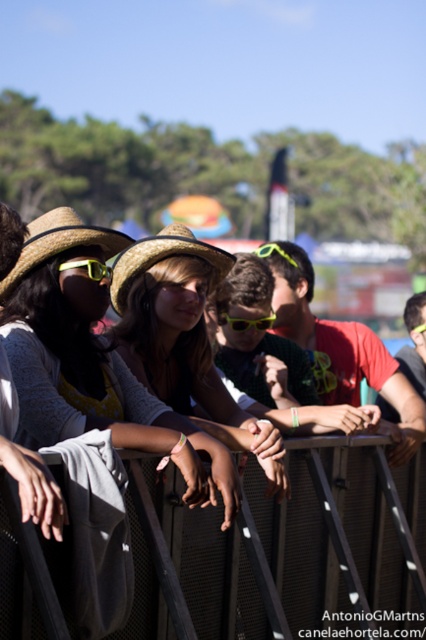
You are standing at the festival and want to reach the point marked at coordinates (261, 524). If your walking speed is 1.2 meters per second, how many seconds will it take you to reach that point?

The point at coordinates (261, 524) is 10.38 meters away from the viewer. At a walking speed of 1.2 meters per second, it would take approximately 8.65 seconds to reach the point.

Based on the photo, you are a photographer trying to capture a clear shot of the black metal fence at lower center and the strawhat at center. Since the fence is narrower than the hat, which object should you focus on first to ensure it fits entirely in your camera frame?

The black metal fence at lower center has a lesser width compared to the strawhat at center, so you should focus on the black metal fence at lower center first to ensure it fits entirely in your camera frame.

You are standing at the festival and want to take a photo of the point at coordinates (8, 540). If your camera has a maximum focus range of 7 meters, will you be able to focus on that point?

The distance of point (8, 540) from the viewer is 7.52 meters, which exceeds the camera maximum focus range of 7 meters. So you won not be able to focus on that point.